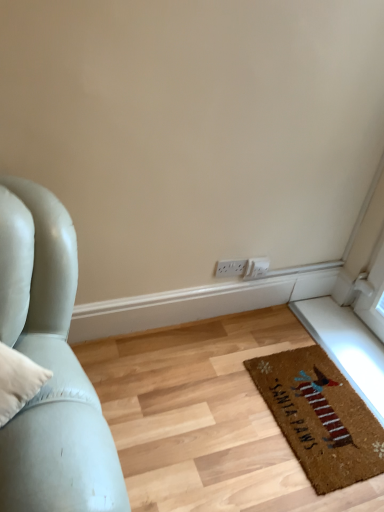
Question: Would you say brown coir mat at lower right is to the left or to the right of white plastic electric outlet at center in the picture?

Choices:
 (A) left
 (B) right

Answer: (B)

Question: From a real-world perspective, relative to white plastic electric outlet at center, is brown coir mat at lower right vertically above or below?

Choices:
 (A) above
 (B) below

Answer: (B)

Question: Is brown coir mat at lower right taller or shorter than white plastic electric outlet at center?

Choices:
 (A) short
 (B) tall

Answer: (A)

Question: Is white plastic electric outlet at center inside the boundaries of brown coir mat at lower right, or outside?

Choices:
 (A) outside
 (B) inside

Answer: (A)

Question: Considering the positions of white plastic electric outlet at center and brown coir mat at lower right in the image, is white plastic electric outlet at center bigger or smaller than brown coir mat at lower right?

Choices:
 (A) big
 (B) small

Answer: (B)

Question: Is white plastic electric outlet at center to the left or to the right of brown coir mat at lower right in the image?

Choices:
 (A) right
 (B) left

Answer: (B)

Question: From the image's perspective, is white plastic electric outlet at center located above or below brown coir mat at lower right?

Choices:
 (A) above
 (B) below

Answer: (A)